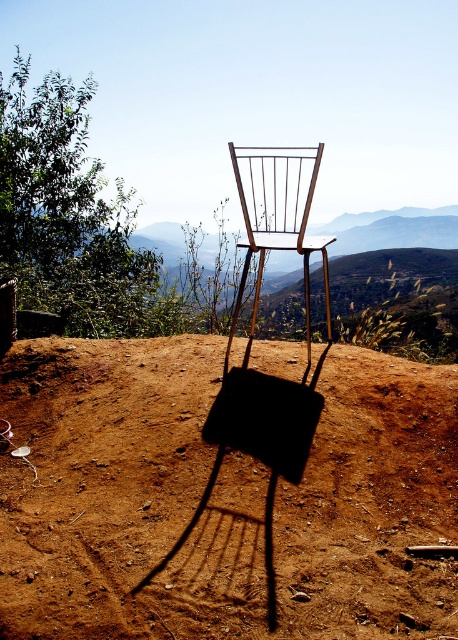
Question: Which object appears closest to the camera in this image?

Choices:
 (A) metallic wire chair at center
 (B) metallic gold chair at center

Answer: (A)

Question: Is brown dirt field at center behind metallic gold chair at center?

Choices:
 (A) no
 (B) yes

Answer: (A)

Question: Which point appears closest to the camera in this image?

Choices:
 (A) (259, 282)
 (B) (143, 609)
 (C) (310, 406)

Answer: (B)

Question: Can you confirm if brown dirt field at center is positioned to the right of metallic wire chair at center?

Choices:
 (A) yes
 (B) no

Answer: (B)

Question: Which of the following is the closest to the observer?

Choices:
 (A) metallic gold chair at center
 (B) brown dirt field at center

Answer: (B)

Question: Considering the relative positions of metallic wire chair at center and metallic gold chair at center in the image provided, where is metallic wire chair at center located with respect to metallic gold chair at center?

Choices:
 (A) right
 (B) left

Answer: (B)